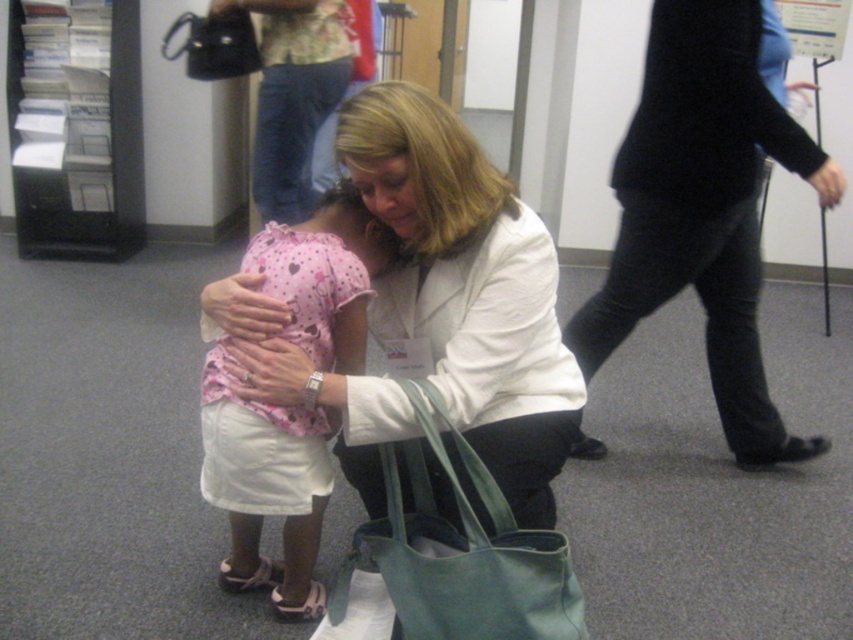
You are standing at the center of the image. There is a point at coordinates point (466,289). What object is located at that point?

The point (466,289) corresponds to the white matte coat at center.

Where is the black sweater at right located in the image?

The black sweater at right is located at point coordinates of 0.323 in the x axis and 0.826 in the y axis.